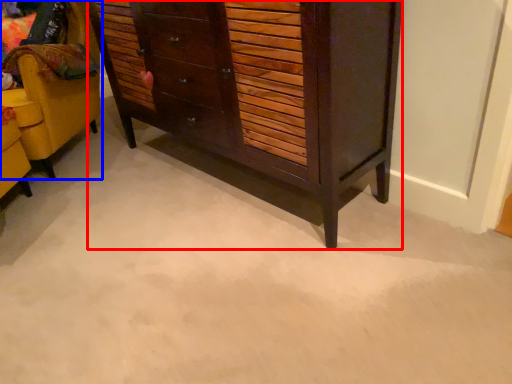
Question: Which object appears closest to the camera in this image, chest of drawers (highlighted by a red box) or furniture (highlighted by a blue box)?

Choices:
 (A) chest of drawers
 (B) furniture

Answer: (A)